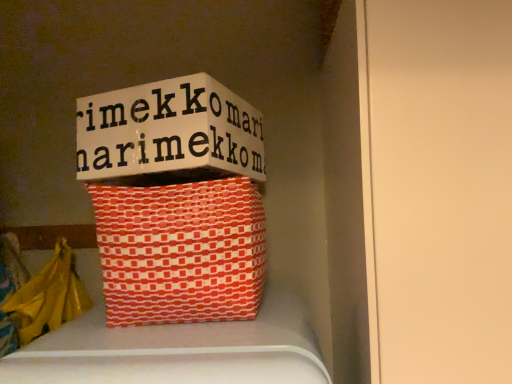
Question: Should I look upward or downward to see white cardboard box at upper center?

Choices:
 (A) down
 (B) up

Answer: (B)

Question: Is orange woven basket at center positioned in front of yellow plastic bag at lower left?

Choices:
 (A) yes
 (B) no

Answer: (A)

Question: Is orange woven basket at center to the right of yellow plastic bag at lower left from the viewer's perspective?

Choices:
 (A) no
 (B) yes

Answer: (B)

Question: Is orange woven basket at center facing away from yellow plastic bag at lower left?

Choices:
 (A) no
 (B) yes

Answer: (A)

Question: Can you see orange woven basket at center touching yellow plastic bag at lower left?

Choices:
 (A) yes
 (B) no

Answer: (B)

Question: Does orange woven basket at center have a greater width compared to yellow plastic bag at lower left?

Choices:
 (A) no
 (B) yes

Answer: (B)

Question: From a real-world perspective, is orange woven basket at center located higher than yellow plastic bag at lower left?

Choices:
 (A) yes
 (B) no

Answer: (A)

Question: Is orange woven basket at center inside yellow plastic bag at lower left?

Choices:
 (A) no
 (B) yes

Answer: (A)

Question: Considering the relative sizes of yellow plastic bag at lower left and orange woven basket at center in the image provided, is yellow plastic bag at lower left wider than orange woven basket at center?

Choices:
 (A) yes
 (B) no

Answer: (B)

Question: Does yellow plastic bag at lower left touch orange woven basket at center?

Choices:
 (A) yes
 (B) no

Answer: (B)

Question: Does yellow plastic bag at lower left lie in front of orange woven basket at center?

Choices:
 (A) no
 (B) yes

Answer: (A)

Question: Is yellow plastic bag at lower left to the left of orange woven basket at center from the viewer's perspective?

Choices:
 (A) yes
 (B) no

Answer: (A)

Question: From a real-world perspective, is yellow plastic bag at lower left on orange woven basket at center?

Choices:
 (A) no
 (B) yes

Answer: (A)

Question: Can you confirm if orange woven basket at center is positioned to the right of white cardboard box at upper center?

Choices:
 (A) yes
 (B) no

Answer: (A)